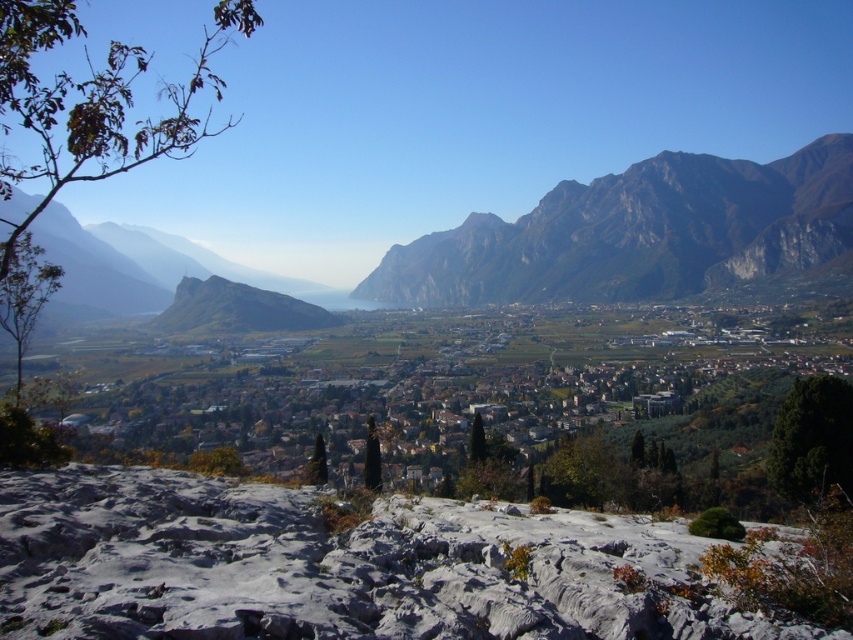
Consider the image. Is gray rough rock at lower center to the right of rugged stone mountain at center from the viewer's perspective?

Correct, you'll find gray rough rock at lower center to the right of rugged stone mountain at center.

Consider the image. Is the position of gray rough rock at lower center more distant than that of rugged stone mountain at center?

No, it is not.

Describe the element at coordinates (335, 566) in the screenshot. I see `gray rough rock at lower center` at that location.

Locate an element on the screen. gray rough rock at lower center is located at coordinates (335, 566).

Can you confirm if rugged stone mountain at upper right is positioned to the left of rugged stone mountain at center?

Incorrect, rugged stone mountain at upper right is not on the left side of rugged stone mountain at center.

Can you confirm if rugged stone mountain at upper right is wider than rugged stone mountain at center?

Indeed, rugged stone mountain at upper right has a greater width compared to rugged stone mountain at center.

At what (x,y) coordinates should I click in order to perform the action: click on rugged stone mountain at upper right. Please return your answer as a coordinate pair (x, y). This screenshot has height=640, width=853. Looking at the image, I should click on (637, 234).

Identify the location of rugged stone mountain at upper right. (637, 234).

Between gray rough rock at lower center and rugged stone mountain at upper right, which one has less height?

gray rough rock at lower center

Who is lower down, gray rough rock at lower center or rugged stone mountain at upper right?

gray rough rock at lower center is lower down.

I want to click on gray rough rock at lower center, so click(335, 566).